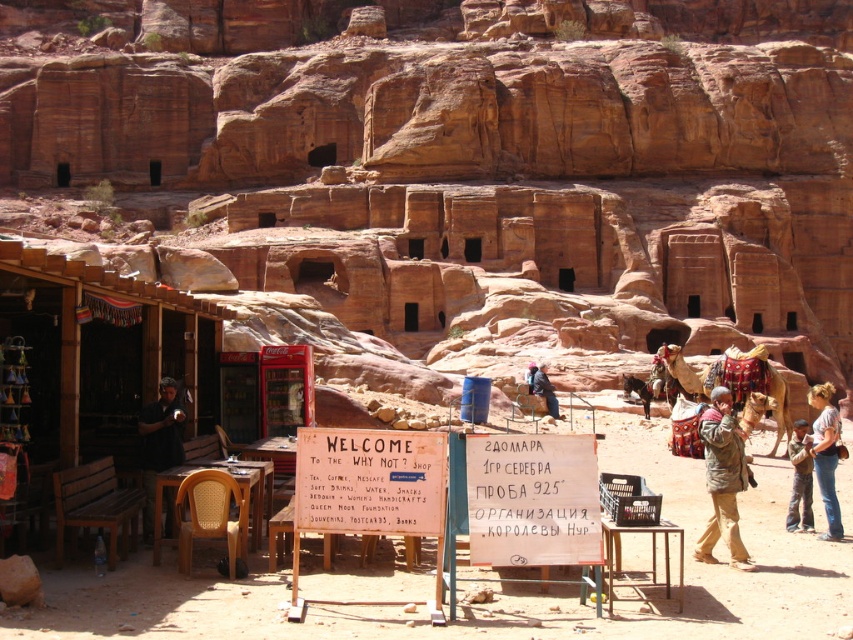
You are a tourist standing at the entrance of the shop in front of the Coca Cola vending machine. You want to take a photo of both the brown fuzzy jacket at lower right and the brown textured camel at center right. Can you fit both in your camera frame if your camera has a maximum field of view of 20 meters width?

The distance between the brown fuzzy jacket at lower right and the brown textured camel at center right is 18.69 meters, which is less than the camera field of view of 20 meters. Therefore, both objects can be captured in a single frame.

You are a traveler standing at the entrance of the shop in front of the Coca Cola vending machine. You see two jackets for sale. The brown fuzzy jacket at lower right and the dark brown leather jacket at center. Which jacket is closer to the ground?

The brown fuzzy jacket at lower right is located below dark brown leather jacket at center, so it is closer to the ground.

You are a visitor at the ancient rock formations in Petra, Jordan. You see a brown fuzzy jacket at lower right and a brown textured camel at center right. Which object is taller?

The brown fuzzy jacket at lower right is much taller than the brown textured camel at center right.